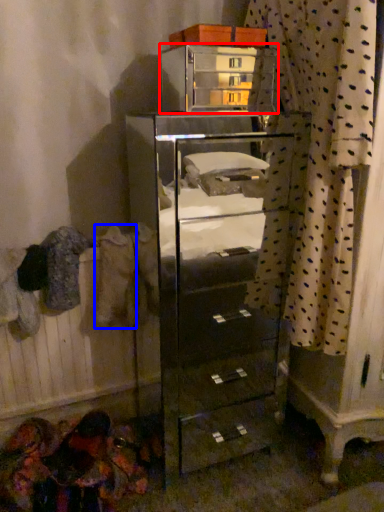
Question: Which point is further to the camera, furniture (highlighted by a red box) or clothing (highlighted by a blue box)?

Choices:
 (A) furniture
 (B) clothing

Answer: (B)